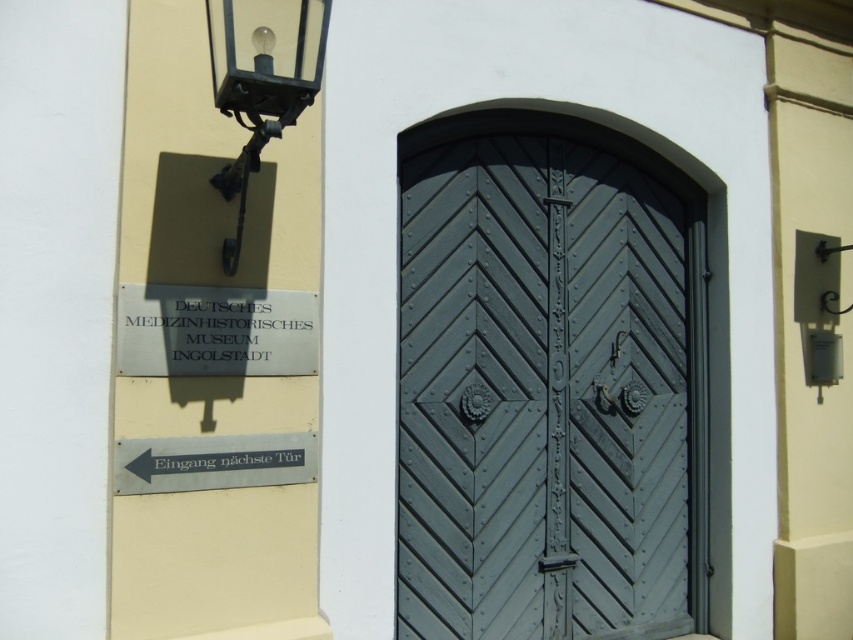
What are the coordinates of the matte gray wood door at center?

The matte gray wood door at center is located at point (x=549, y=384).

You are standing in front of the museum entrance and want to read both the silver metallic sign at upper left and the silver metallic sign at lower left. Which sign is closer to you?

The silver metallic sign at upper left is closer to you because the silver metallic sign at lower left is behind it.